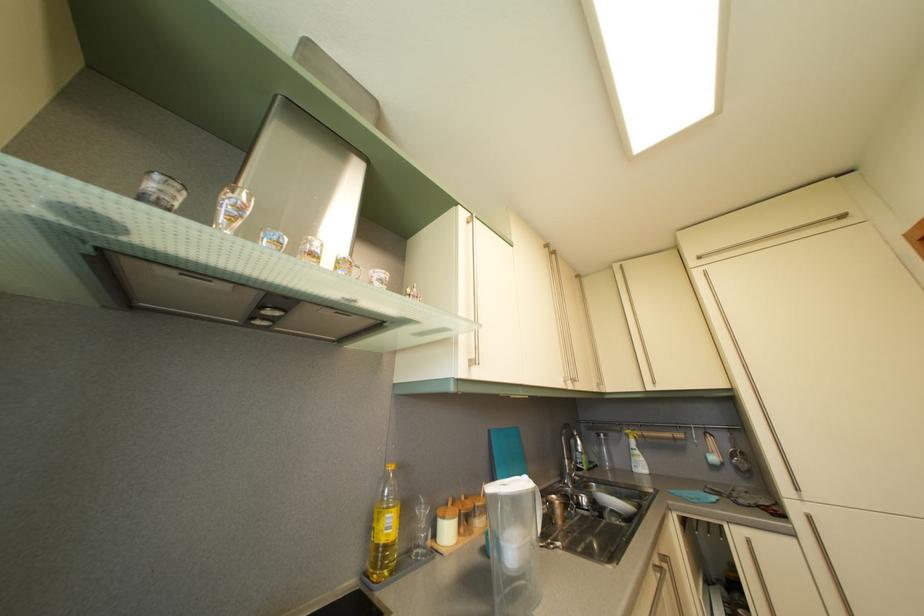
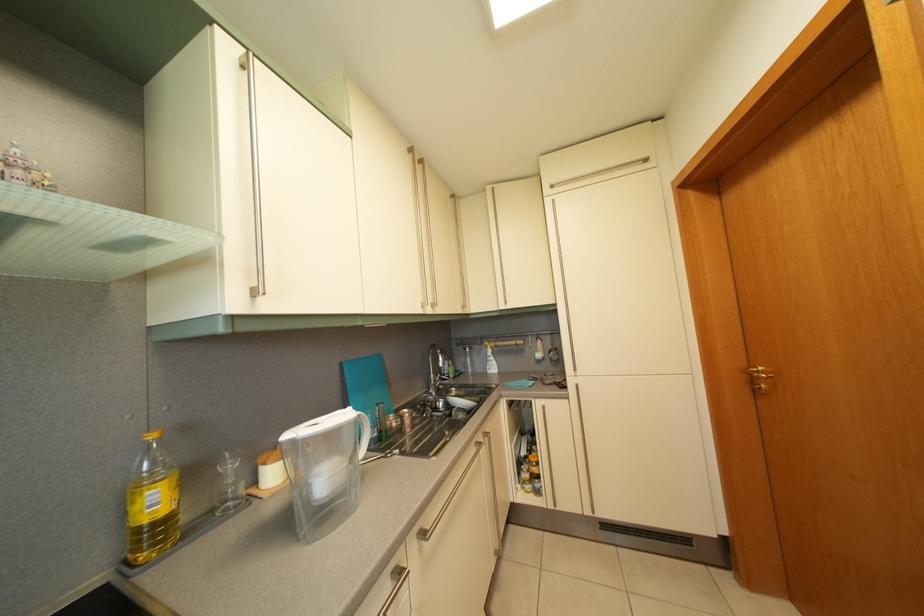
How did the camera likely rotate?

The rotation direction of the camera is right-down.